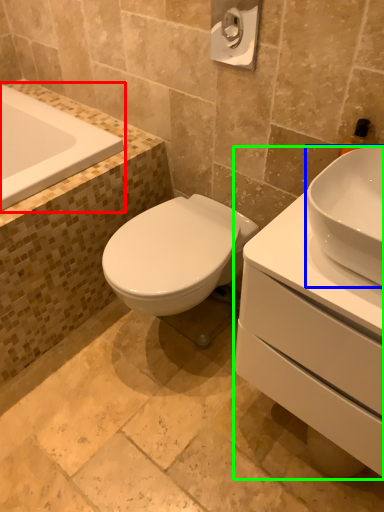
Question: Estimate the real-world distances between objects in this image. Which object is closer to bathtub (highlighted by a red box), sink (highlighted by a blue box) or porcelain (highlighted by a green box)?

Choices:
 (A) sink
 (B) porcelain

Answer: (B)